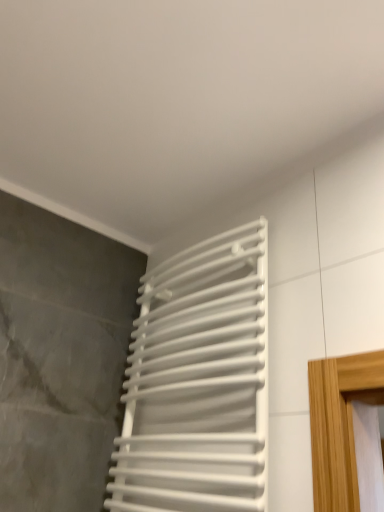
I want to click on white matte radiator at center, so click(198, 382).

What do you see at coordinates (198, 382) in the screenshot? Image resolution: width=384 pixels, height=512 pixels. I see `white matte radiator at center` at bounding box center [198, 382].

Identify the location of white matte radiator at center. (198, 382).